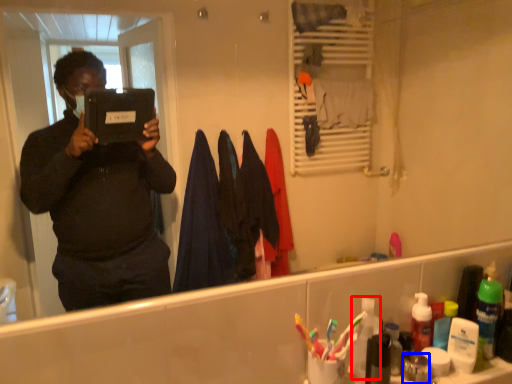
Question: Which point is further to the camera, toiletry (highlighted by a red box) or toiletry (highlighted by a blue box)?

Choices:
 (A) toiletry
 (B) toiletry

Answer: (A)